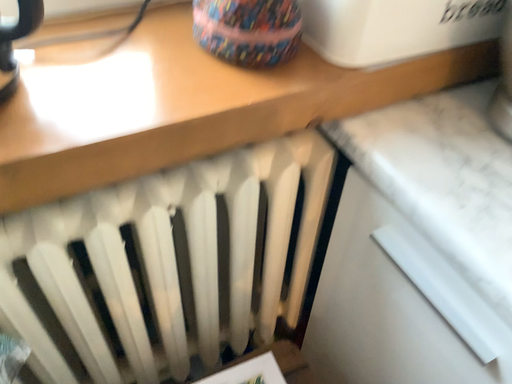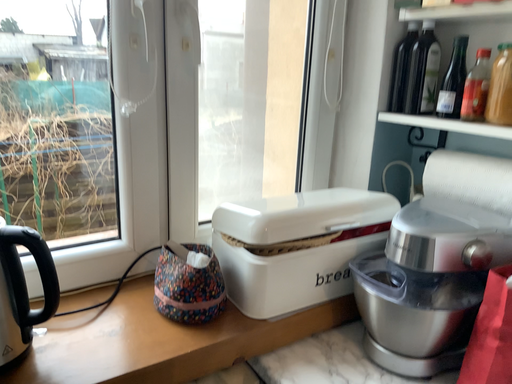
Question: Which way did the camera rotate in the video?

Choices:
 (A) rotated upward
 (B) rotated downward

Answer: (A)